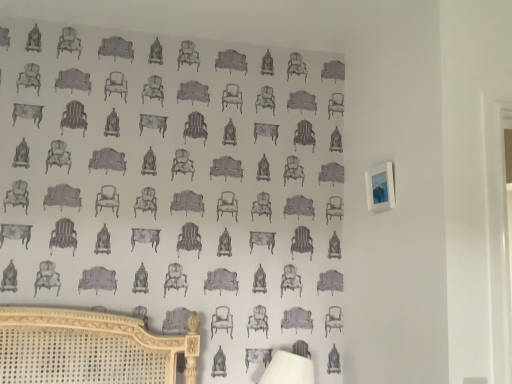
Question: In terms of size, does blue glossy picture frame at upper right appear bigger or smaller than white fabric table lamp at lower center?

Choices:
 (A) big
 (B) small

Answer: (B)

Question: Considering the positions of point (390, 168) and point (286, 365), is point (390, 168) closer or farther from the camera than point (286, 365)?

Choices:
 (A) farther
 (B) closer

Answer: (B)

Question: Considering the positions of blue glossy picture frame at upper right and white fabric table lamp at lower center in the image, is blue glossy picture frame at upper right wider or thinner than white fabric table lamp at lower center?

Choices:
 (A) wide
 (B) thin

Answer: (B)

Question: Considering the positions of white fabric table lamp at lower center and blue glossy picture frame at upper right in the image, is white fabric table lamp at lower center wider or thinner than blue glossy picture frame at upper right?

Choices:
 (A) wide
 (B) thin

Answer: (A)

Question: From the image's perspective, is white fabric table lamp at lower center located above or below blue glossy picture frame at upper right?

Choices:
 (A) below
 (B) above

Answer: (A)

Question: From their relative heights in the image, would you say white fabric table lamp at lower center is taller or shorter than blue glossy picture frame at upper right?

Choices:
 (A) tall
 (B) short

Answer: (A)

Question: Does point (283, 365) appear closer or farther from the camera than point (377, 206)?

Choices:
 (A) farther
 (B) closer

Answer: (B)